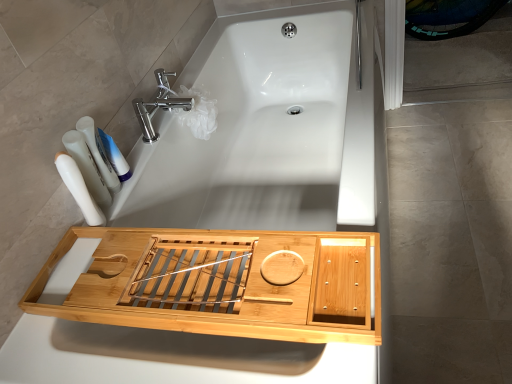
Question: Considering their positions, is polished chrome faucet at upper center located in front of or behind white plastic bottles at left, marked as the third toiletry in a front-to-back arrangement?

Choices:
 (A) behind
 (B) front

Answer: (A)

Question: From the image's perspective, is polished chrome faucet at upper center located above or below white plastic bottles at left, placed as the first toiletry when sorted from back to front?

Choices:
 (A) below
 (B) above

Answer: (B)

Question: Considering the real-world distances, which object is farthest from the white plastic toothbrushes at left, which is counted as the second toiletry, starting from the front?

Choices:
 (A) white matte toothpaste at upper left
 (B) white plastic bottles at left, which appears as the 3th toiletry when viewed from the back
 (C) natural wood bath tray at center
 (D) polished chrome faucet at upper center
 (E) natural wood tray at center

Answer: (C)

Question: Based on their relative distances, which object is farther from the polished chrome faucet at upper center?

Choices:
 (A) white plastic bottles at left, placed as the first toiletry when sorted from back to front
 (B) white plastic toothbrushes at left, which is counted as the second toiletry, starting from the front
 (C) white matte toothpaste at upper left
 (D) natural wood bath tray at center
 (E) white plastic bottles at left, which ranks as the 1th toiletry in front-to-back order

Answer: (D)